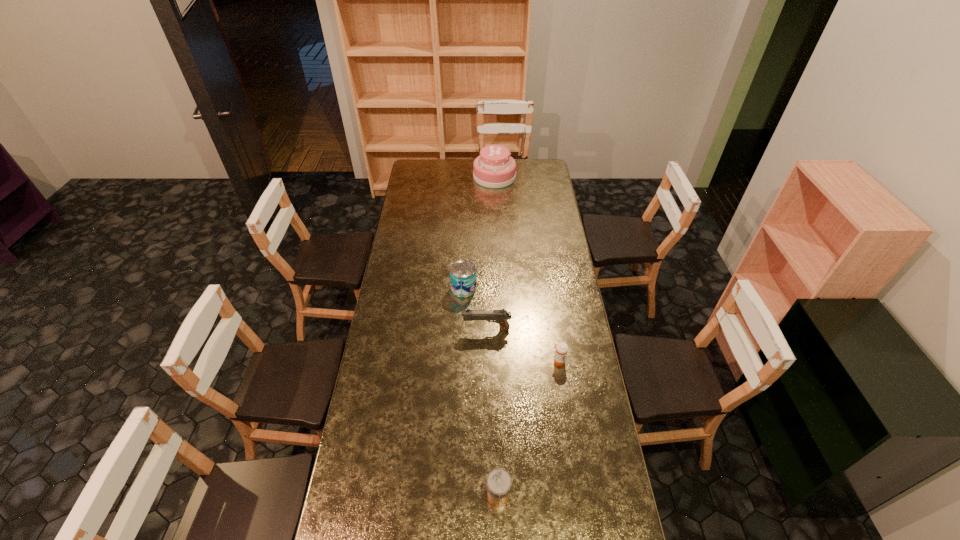
Where is `object that stands as the closest to the third farthest object`? This screenshot has width=960, height=540. object that stands as the closest to the third farthest object is located at coordinates (463, 279).

At what (x,y) coordinates should I click in order to perform the action: click on free space that satisfies the following two spatial constraints: 1. on the back side of the farthest object; 2. on the left side of the second farthest object. Please return your answer as a coordinate pair (x, y). Looking at the image, I should click on (468, 177).